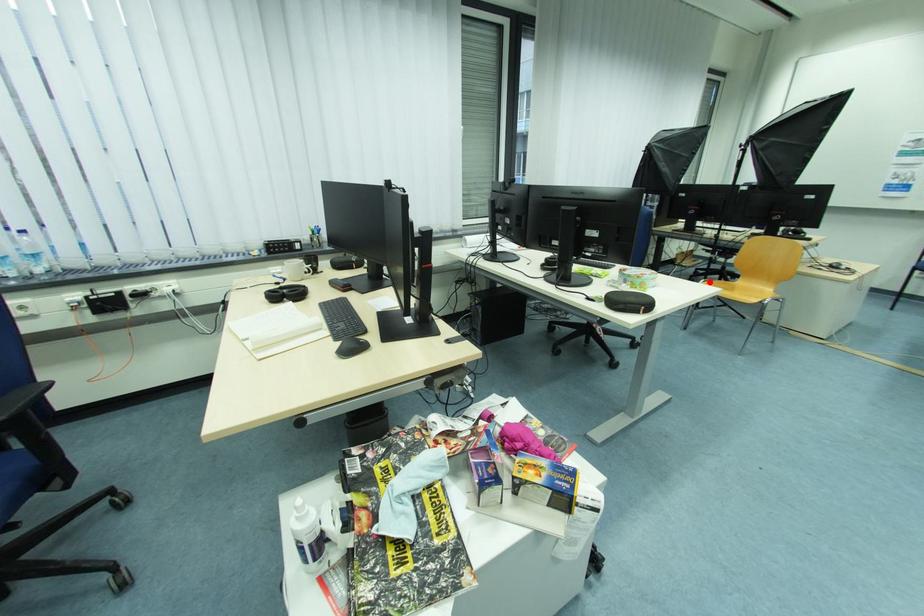
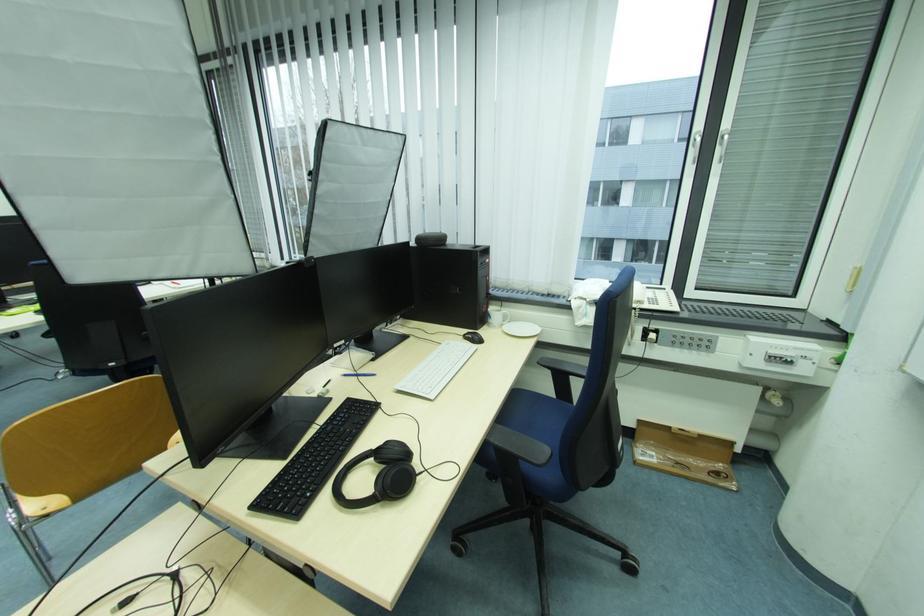
Question: I am providing you with two images of the same scene from different viewpoints. A red point is marked on the first image. At the location where the point appears in image 1, is it still visible in image 2?

Choices:
 (A) Yes
 (B) No

Answer: (B)